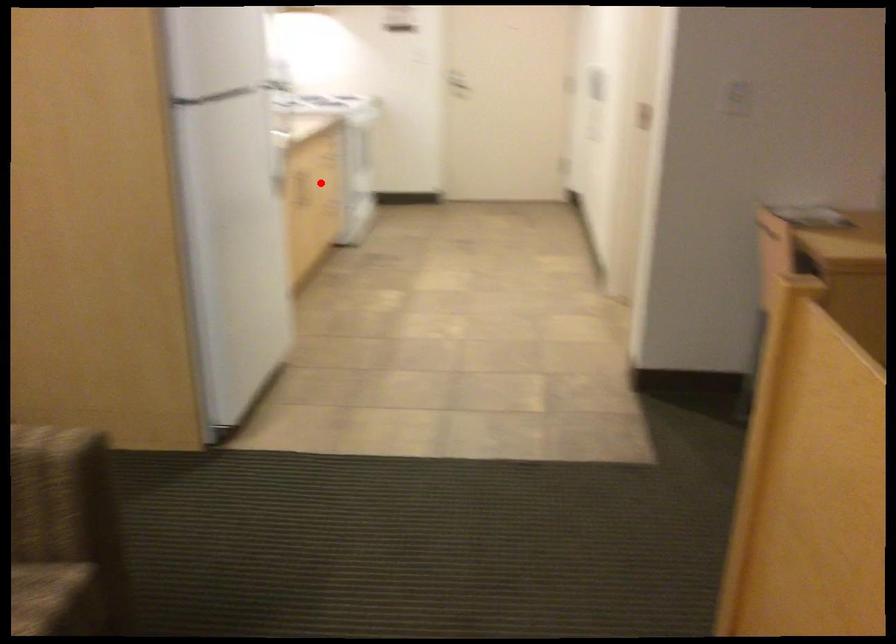
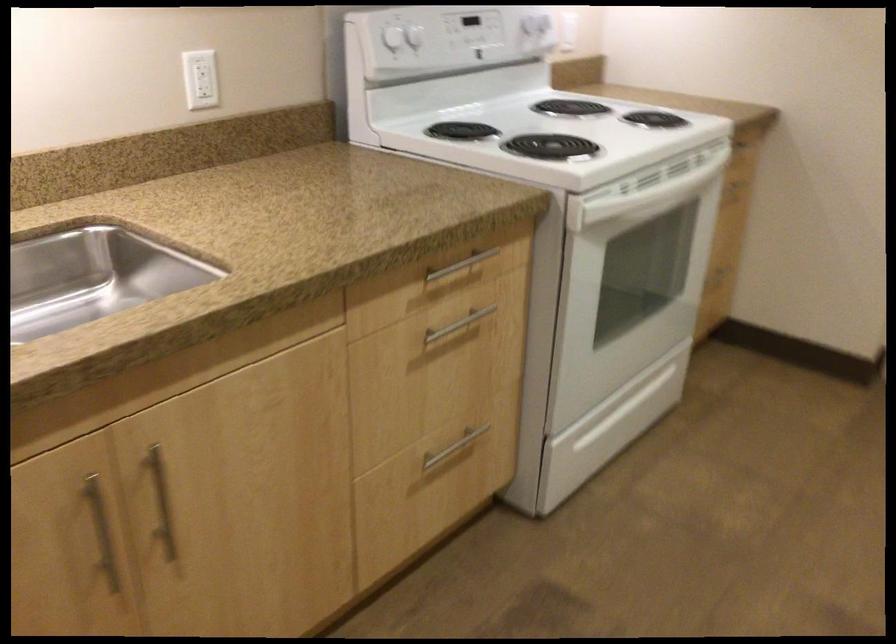
Question: I am providing you with two images of the same scene from different viewpoints. Given a red point in image1, look at the same physical point in image2. Is it:

Choices:
 (A) Closer to the viewpoint
 (B) Farther from the viewpoint

Answer: (A)